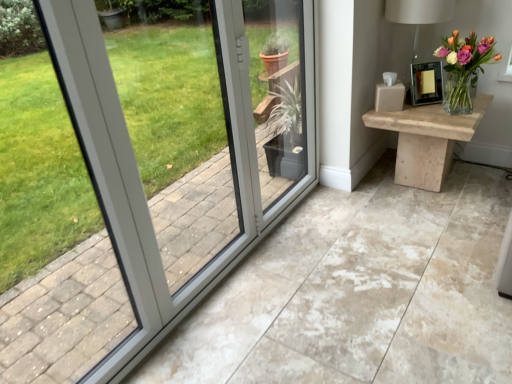
Identify the location of vacant location below natural wood table at right (from a real-world perspective). pos(418,188).